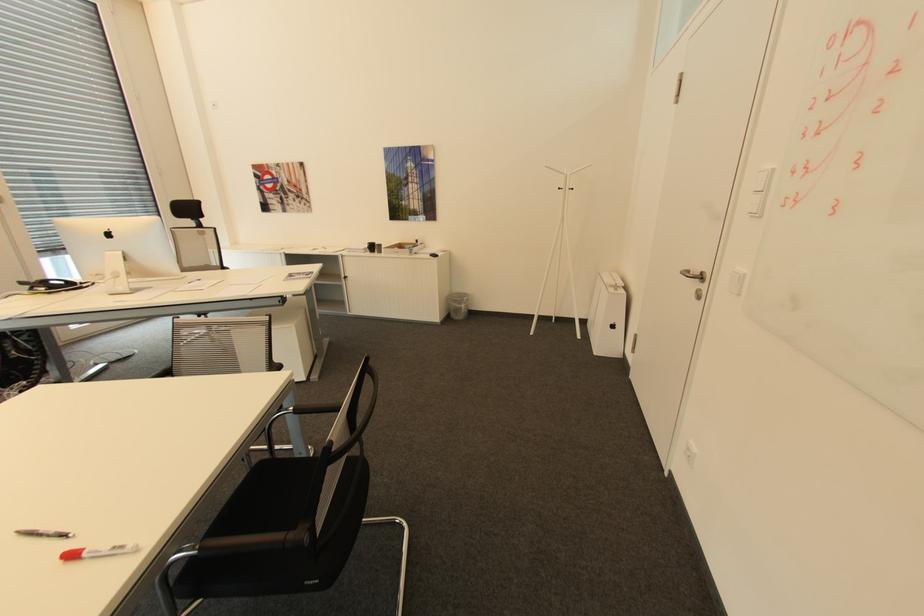
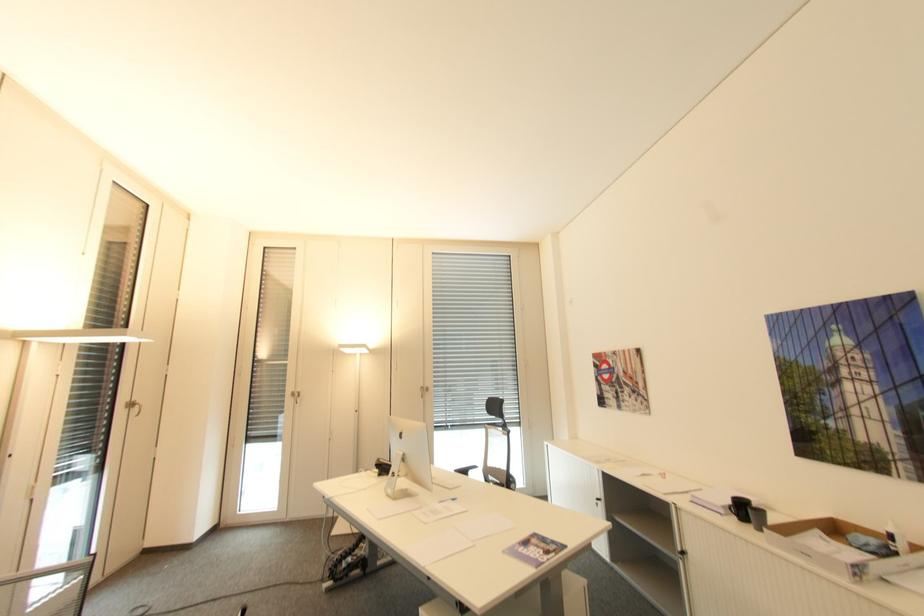
The point at [383,245] is marked in the first image. Where is the corresponding point in the second image?

(766, 513)